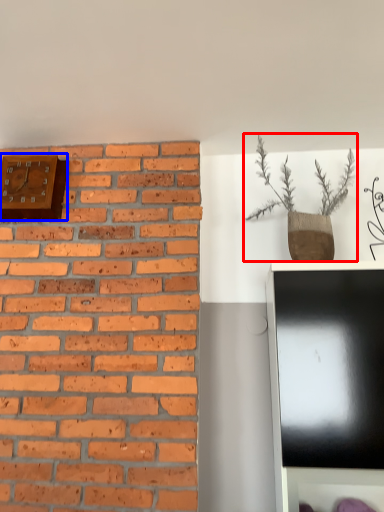
Question: Which point is closer to the camera, houseplant (highlighted by a red box) or clock (highlighted by a blue box)?

Choices:
 (A) houseplant
 (B) clock

Answer: (A)